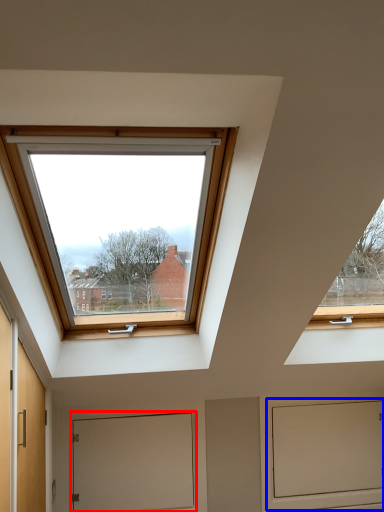
Question: Which object is further to the camera taking this photo, door (highlighted by a red box) or screen door (highlighted by a blue box)?

Choices:
 (A) door
 (B) screen door

Answer: (B)